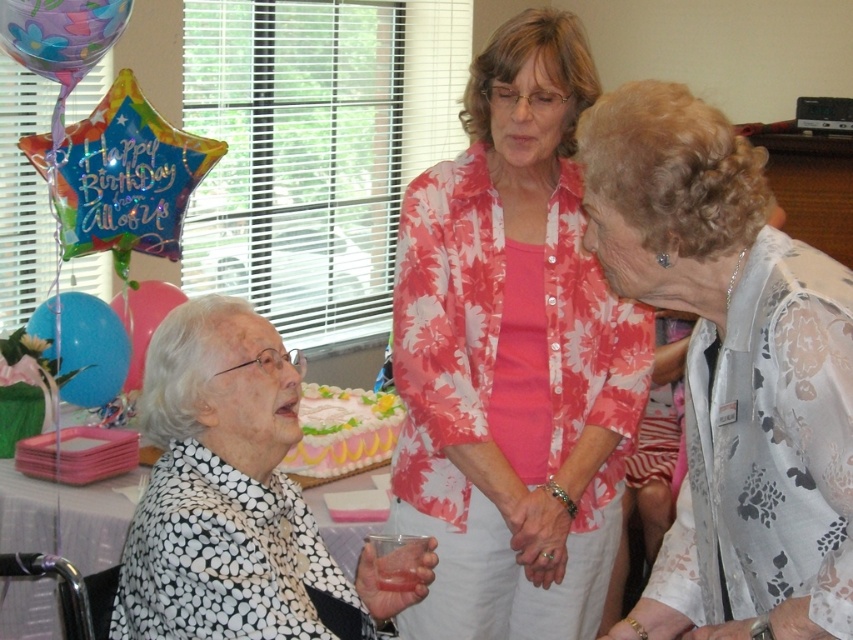
You are a photographer at the event and want to capture a photo of both the black dotted scarf at lower left and the woman standing to the right. The camera you are using has a maximum focus range of 5 feet. Will you be able to include both subjects in the same photo without moving either?

The distance between the black dotted scarf at lower left and the woman standing to the right is 4.60 feet, which is within the camera maximum focus range of 5 feet. Therefore, both subjects can be captured in the same photo without moving them.

You are a photographer trying to capture a group photo of the black dotted scarf at lower left and the white frosted cake at center. Since you want to ensure both subjects are clearly visible, which one should you focus on first considering their sizes?

The black dotted scarf at lower left is larger than the white frosted cake at center, so you should focus on the black dotted scarf at lower left first to ensure its details are sharp before adjusting for the smaller cake.

You are a photographer at a birthday party and want to capture a photo of the pink floral blouse at center and the blue glossy balloon at lower left. Which object should you focus on first to ensure both are in the frame?

The pink floral blouse at center is in front of the blue glossy balloon at lower left, so you should focus on the pink floral blouse at center first to ensure both are in the frame.